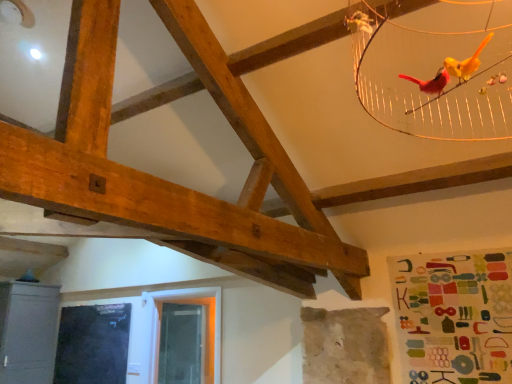
Question: Is metallic gray cabinet at lower left smaller than transparent plastic window screen at lower center, the 1th window screen positioned from the right?

Choices:
 (A) yes
 (B) no

Answer: (B)

Question: From the image's perspective, does metallic gray cabinet at lower left appear lower than transparent plastic window screen at lower center, which is the second window screen in left-to-right order?

Choices:
 (A) yes
 (B) no

Answer: (B)

Question: Does metallic gray cabinet at lower left have a larger size compared to transparent plastic window screen at lower center, the 1th window screen positioned from the right?

Choices:
 (A) no
 (B) yes

Answer: (B)

Question: Is metallic gray cabinet at lower left aimed at transparent plastic window screen at lower center, the 1th window screen positioned from the right?

Choices:
 (A) yes
 (B) no

Answer: (B)

Question: Is transparent plastic window screen at lower center, the 1th window screen positioned from the right, completely or partially inside metallic gray cabinet at lower left?

Choices:
 (A) no
 (B) yes

Answer: (A)

Question: Would you say black glass window screen at lower left, placed as the 2th window screen when sorted from right to left, is to the left or to the right of metallic gray cabinet at lower left in the picture?

Choices:
 (A) right
 (B) left

Answer: (A)

Question: From the image's perspective, is black glass window screen at lower left, which is counted as the first window screen, starting from the left, located above or below metallic gray cabinet at lower left?

Choices:
 (A) above
 (B) below

Answer: (B)

Question: Is black glass window screen at lower left, placed as the 2th window screen when sorted from right to left, situated inside metallic gray cabinet at lower left or outside?

Choices:
 (A) inside
 (B) outside

Answer: (B)

Question: Considering their positions, is black glass window screen at lower left, which is counted as the first window screen, starting from the left, located in front of or behind metallic gray cabinet at lower left?

Choices:
 (A) behind
 (B) front

Answer: (B)

Question: Is black glass window screen at lower left, which is counted as the first window screen, starting from the left, in front of or behind transparent plastic window screen at lower center, which is the second window screen in left-to-right order, in the image?

Choices:
 (A) front
 (B) behind

Answer: (A)

Question: From a real-world perspective, is black glass window screen at lower left, placed as the 2th window screen when sorted from right to left, above or below transparent plastic window screen at lower center, the 1th window screen positioned from the right?

Choices:
 (A) above
 (B) below

Answer: (B)

Question: Looking at their shapes, would you say black glass window screen at lower left, placed as the 2th window screen when sorted from right to left, is wider or thinner than transparent plastic window screen at lower center, which is the second window screen in left-to-right order?

Choices:
 (A) wide
 (B) thin

Answer: (B)

Question: Considering the relative positions of black glass window screen at lower left, which is counted as the first window screen, starting from the left, and transparent plastic window screen at lower center, the 1th window screen positioned from the right, in the image provided, is black glass window screen at lower left, which is counted as the first window screen, starting from the left, to the left or to the right of transparent plastic window screen at lower center, the 1th window screen positioned from the right,?

Choices:
 (A) left
 (B) right

Answer: (A)

Question: Visually, is transparent plastic window screen at lower center, the 1th window screen positioned from the right, positioned to the left or to the right of metallic gray cabinet at lower left?

Choices:
 (A) left
 (B) right

Answer: (B)

Question: Relative to metallic gray cabinet at lower left, is transparent plastic window screen at lower center, the 1th window screen positioned from the right, in front or behind?

Choices:
 (A) front
 (B) behind

Answer: (B)